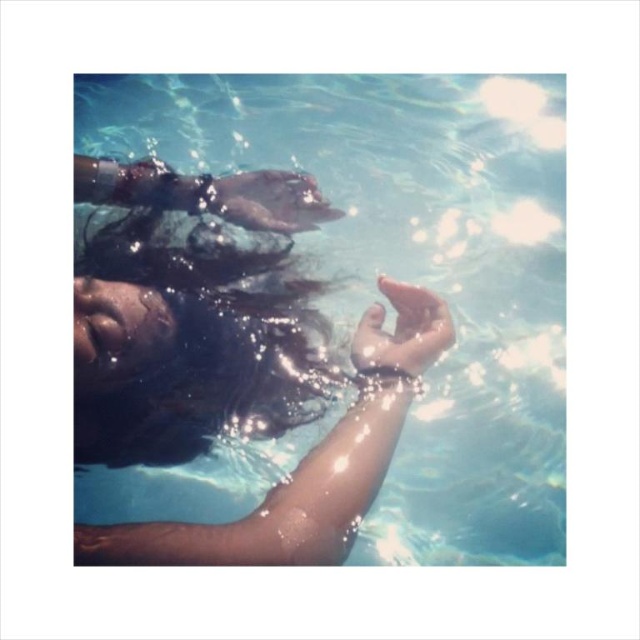
You are a diver preparing to take a photo of the point at coordinates point (198, 451). The camera you are using has a minimum focus distance of 1.2 meters. Will the camera be able to focus on the point?

The distance of point (198, 451) from the camera is 1.32 meters, which is greater than the camera minimum focus distance of 1.2 meters. Therefore, the camera can focus on the point.

In the scene shown: You are a lifeguard observing the underwater scene. You notice the clear water at center and the smooth skin hand at center. Which object is closer to you?

The clear water at center is closer to the viewer than the smooth skin hand at center.